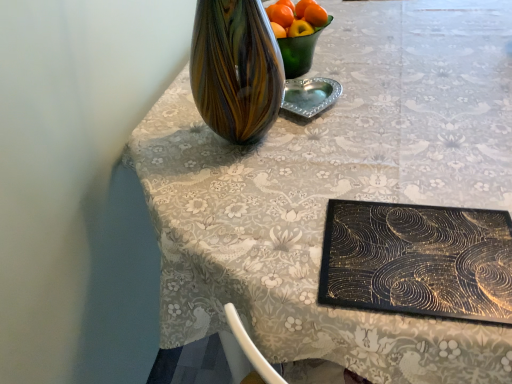
Identify the location of vacant area situated below silver metallic heart-shaped tray at center (from a real-world perspective). (311, 102).